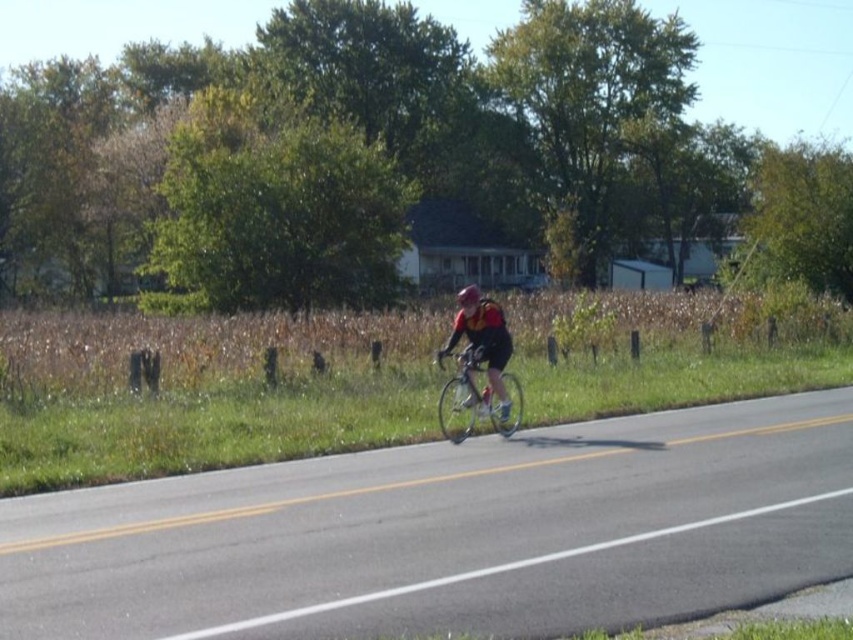
Looking at this image, between shiny metallic bicycle at center and matte black helmet at center, which one appears on the right side from the viewer's perspective?

matte black helmet at center

Between shiny metallic bicycle at center and matte black helmet at center, which one has less height?

With less height is shiny metallic bicycle at center.

Is point (451, 376) in front of point (463, 291)?

No, it is behind (463, 291).

Where is `shiny metallic bicycle at center`? shiny metallic bicycle at center is located at coordinates (476, 401).

Between point (498, 397) and point (471, 298), which one is positioned in front?

Point (471, 298) is in front.

Who is higher up, matte black cycling outfit at center or matte black helmet at center?

matte black helmet at center is higher up.

Where is `matte black cycling outfit at center`? The width and height of the screenshot is (853, 640). matte black cycling outfit at center is located at coordinates (483, 339).

What are the coordinates of `matte black cycling outfit at center` in the screenshot? It's located at (483, 339).

Can you confirm if shiny metallic bicycle at center is thinner than matte black cycling outfit at center?

No.

Is shiny metallic bicycle at center above matte black cycling outfit at center?

Actually, shiny metallic bicycle at center is below matte black cycling outfit at center.

You are a GUI agent. You are given a task and a screenshot of the screen. Output one action in this format:
    pyautogui.click(x=<x>, y=<y>)
    Task: Click on the shiny metallic bicycle at center
    
    Given the screenshot: What is the action you would take?
    pyautogui.click(x=476, y=401)

In order to click on shiny metallic bicycle at center in this screenshot , I will do `click(476, 401)`.